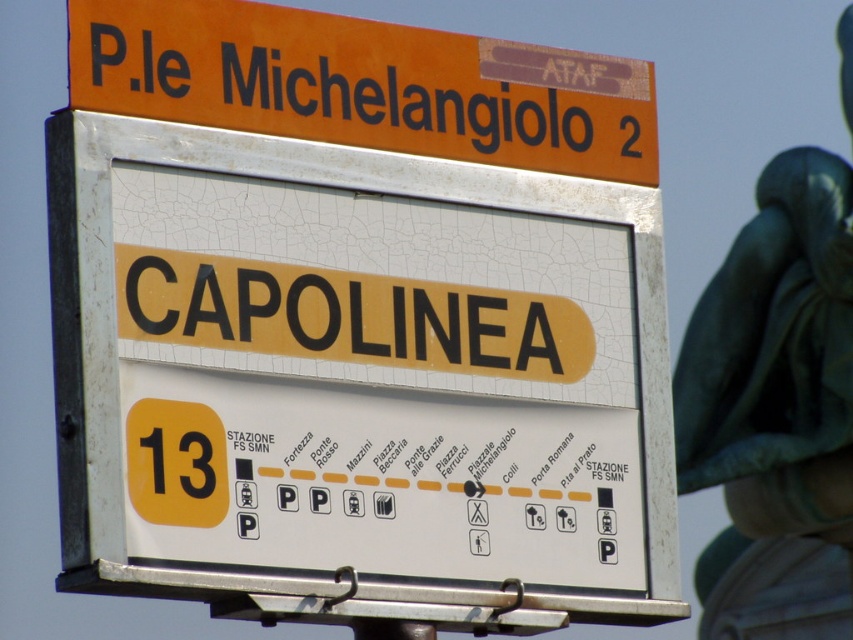
Question: Can you confirm if white cracked plastic sign at center is positioned below orange matte sign at upper center?

Choices:
 (A) yes
 (B) no

Answer: (A)

Question: Which object appears farthest from the camera in this image?

Choices:
 (A) orange matte sign at upper center
 (B) white cracked plastic sign at center

Answer: (A)

Question: Does white cracked plastic sign at center have a lesser width compared to orange matte sign at upper center?

Choices:
 (A) no
 (B) yes

Answer: (A)

Question: Does white cracked plastic sign at center appear on the right side of orange matte sign at upper center?

Choices:
 (A) yes
 (B) no

Answer: (A)

Question: Which point appears farthest from the camera in this image?

Choices:
 (A) (233, 394)
 (B) (283, 108)

Answer: (B)